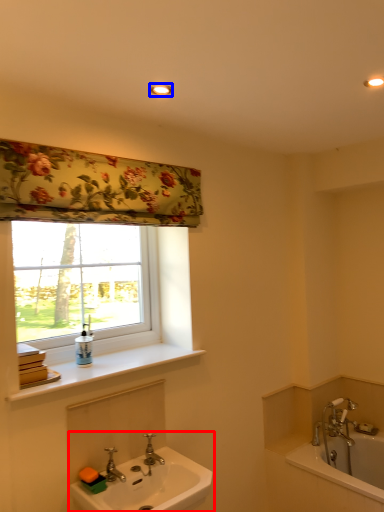
Question: Among these objects, which one is farthest to the camera, sink (highlighted by a red box) or light fixture (highlighted by a blue box)?

Choices:
 (A) sink
 (B) light fixture

Answer: (B)